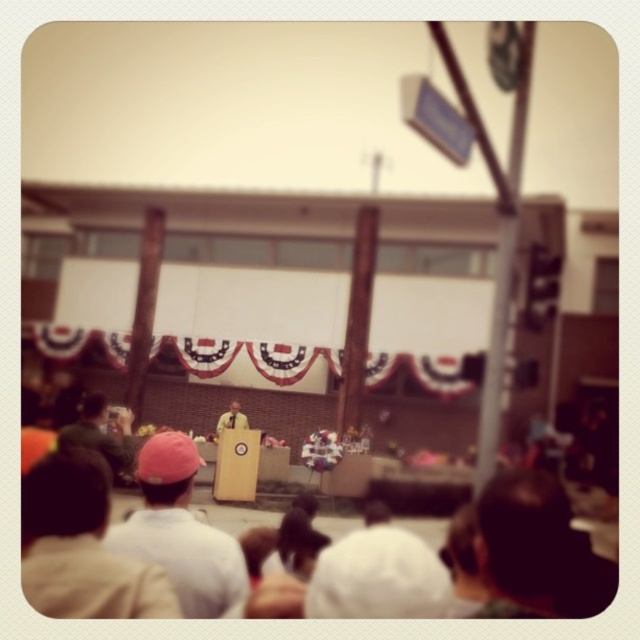
You are attending the outdoor event and want to locate the dark brown leather hat at lower right. According to the coordinates provided, where exactly should you look on the image to find it?

The dark brown leather hat at lower right is located at the coordinates point (536, 552).

You are attending an outdoor event and notice two hats on the ground near the podium. The dark brown leather hat at lower right and the white matte cap at lower left. Which hat is closer to you?

The dark brown leather hat at lower right is closer to you because it is in front of the white matte cap at lower left.